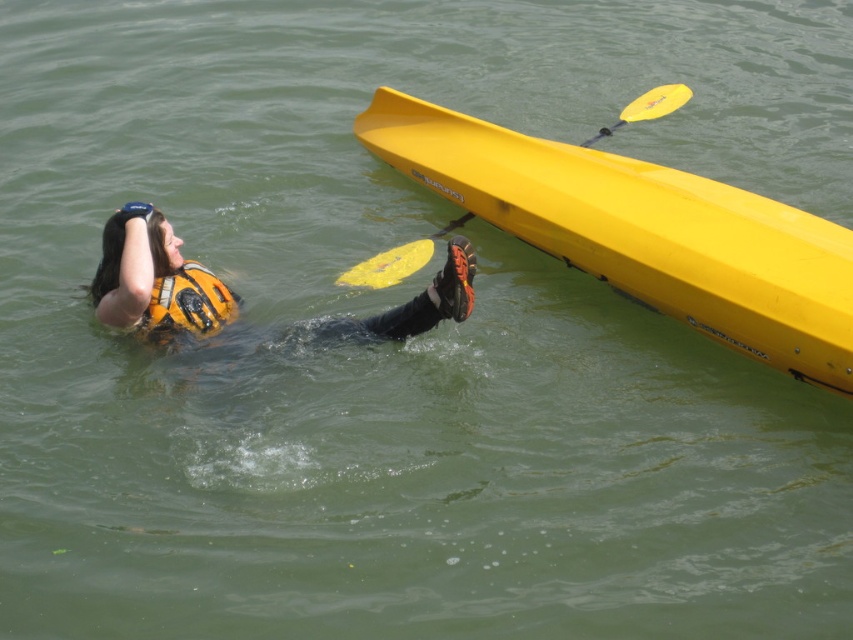
Can you confirm if yellow matte canoe at upper right is positioned to the left of orange life vest at upper left?

In fact, yellow matte canoe at upper right is to the right of orange life vest at upper left.

Which of these two, yellow matte canoe at upper right or orange life vest at upper left, stands shorter?

orange life vest at upper left is shorter.

Find the location of `yellow matte canoe at upper right`. yellow matte canoe at upper right is located at coordinates (643, 232).

Find the location of a particular element. Image resolution: width=853 pixels, height=640 pixels. yellow matte canoe at upper right is located at coordinates (643, 232).

Between yellow matte canoe at upper right and orange matte life jacket at lower left, which one is positioned lower?

orange matte life jacket at lower left is lower down.

Who is more forward, (717, 243) or (167, 321)?

Point (717, 243) is in front.

Measure the distance between yellow matte canoe at upper right and camera.

yellow matte canoe at upper right is 5.26 meters away from camera.

Where is `yellow matte canoe at upper right`? The width and height of the screenshot is (853, 640). yellow matte canoe at upper right is located at coordinates (643, 232).

Can you confirm if orange life vest at upper left is thinner than orange matte life jacket at lower left?

No, orange life vest at upper left is not thinner than orange matte life jacket at lower left.

Is orange life vest at upper left bigger than orange matte life jacket at lower left?

Correct, orange life vest at upper left is larger in size than orange matte life jacket at lower left.

At what (x,y) coordinates should I click in order to perform the action: click on orange life vest at upper left. Please return your answer as a coordinate pair (x, y). Looking at the image, I should click on (155, 280).

Where is `orange life vest at upper left`? orange life vest at upper left is located at coordinates (155, 280).